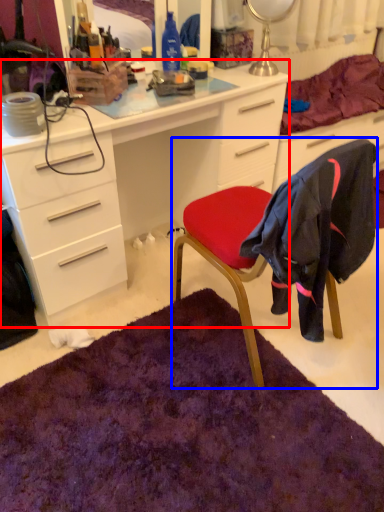
Question: Which object is closer to the camera taking this photo, desk (highlighted by a red box) or chair (highlighted by a blue box)?

Choices:
 (A) desk
 (B) chair

Answer: (B)